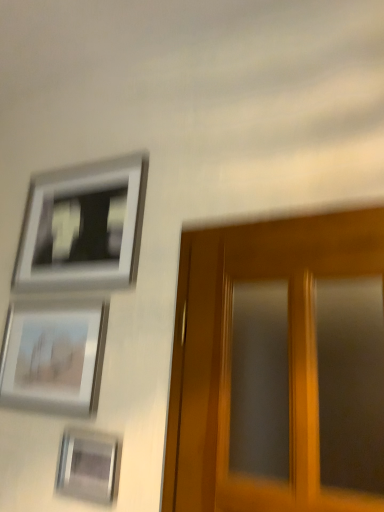
Question: From their relative heights in the image, would you say metallic silver picture frame at lower left, positioned as the third picture frame in top-to-bottom order, is taller or shorter than matte silver picture frame at lower left, the 2th picture frame when ordered from bottom to top?

Choices:
 (A) short
 (B) tall

Answer: (A)

Question: From a real-world perspective, is metallic silver picture frame at lower left, the 1th picture frame ordered from the bottom, physically located above or below matte silver picture frame at lower left, the 2th picture frame when ordered from bottom to top?

Choices:
 (A) above
 (B) below

Answer: (B)

Question: Estimate the real-world distances between objects in this image. Which object is closer to the metallic silver picture frame at lower left, the 1th picture frame ordered from the bottom?

Choices:
 (A) matte silver picture frame at lower left, the 2th picture frame when ordered from top to bottom
 (B) silver metallic picture frame at upper left, which is the first picture frame from top to bottom

Answer: (A)

Question: Based on their relative distances, which object is farther from the metallic silver picture frame at lower left, the 1th picture frame ordered from the bottom?

Choices:
 (A) matte silver picture frame at lower left, the 2th picture frame when ordered from bottom to top
 (B) silver metallic picture frame at upper left, which is the third picture frame from bottom to top

Answer: (B)